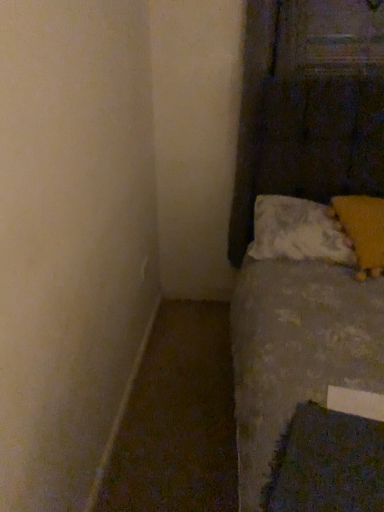
Question: Can you confirm if white soft pillow at lower right, which is the 2th pillow from right to left, is thinner than yellow fuzzy pillow at upper right, positioned as the first pillow in right-to-left order?

Choices:
 (A) yes
 (B) no

Answer: (A)

Question: From the image's perspective, is white soft pillow at lower right, positioned as the first pillow in left-to-right order, located beneath yellow fuzzy pillow at upper right, positioned as the first pillow in right-to-left order?

Choices:
 (A) yes
 (B) no

Answer: (B)

Question: Does white soft pillow at lower right, which is the 2th pillow from right to left, appear on the right side of yellow fuzzy pillow at upper right, positioned as the first pillow in right-to-left order?

Choices:
 (A) no
 (B) yes

Answer: (A)

Question: From a real-world perspective, is white soft pillow at lower right, positioned as the first pillow in left-to-right order, physically below yellow fuzzy pillow at upper right, positioned as the first pillow in right-to-left order?

Choices:
 (A) yes
 (B) no

Answer: (A)

Question: Would you say white soft pillow at lower right, positioned as the first pillow in left-to-right order, is outside yellow fuzzy pillow at upper right, acting as the second pillow starting from the left?

Choices:
 (A) yes
 (B) no

Answer: (B)

Question: Is white soft pillow at lower right, positioned as the first pillow in left-to-right order, behind yellow fuzzy pillow at upper right, acting as the second pillow starting from the left?

Choices:
 (A) no
 (B) yes

Answer: (B)

Question: Is white soft pillow at lower right, positioned as the first pillow in left-to-right order, outside dark blue textured sheet at lower right?

Choices:
 (A) no
 (B) yes

Answer: (B)

Question: Is white soft pillow at lower right, positioned as the first pillow in left-to-right order, looking in the opposite direction of dark blue textured sheet at lower right?

Choices:
 (A) yes
 (B) no

Answer: (B)

Question: Is white soft pillow at lower right, which is the 2th pillow from right to left, smaller than dark blue textured sheet at lower right?

Choices:
 (A) no
 (B) yes

Answer: (A)

Question: Can you confirm if white soft pillow at lower right, which is the 2th pillow from right to left, is positioned to the left of dark blue textured sheet at lower right?

Choices:
 (A) no
 (B) yes

Answer: (A)

Question: Can you confirm if white soft pillow at lower right, positioned as the first pillow in left-to-right order, is wider than dark blue textured sheet at lower right?

Choices:
 (A) yes
 (B) no

Answer: (A)

Question: Is there a large distance between dark blue textured sheet at lower right and yellow fuzzy pillow at upper right, positioned as the first pillow in right-to-left order?

Choices:
 (A) no
 (B) yes

Answer: (B)